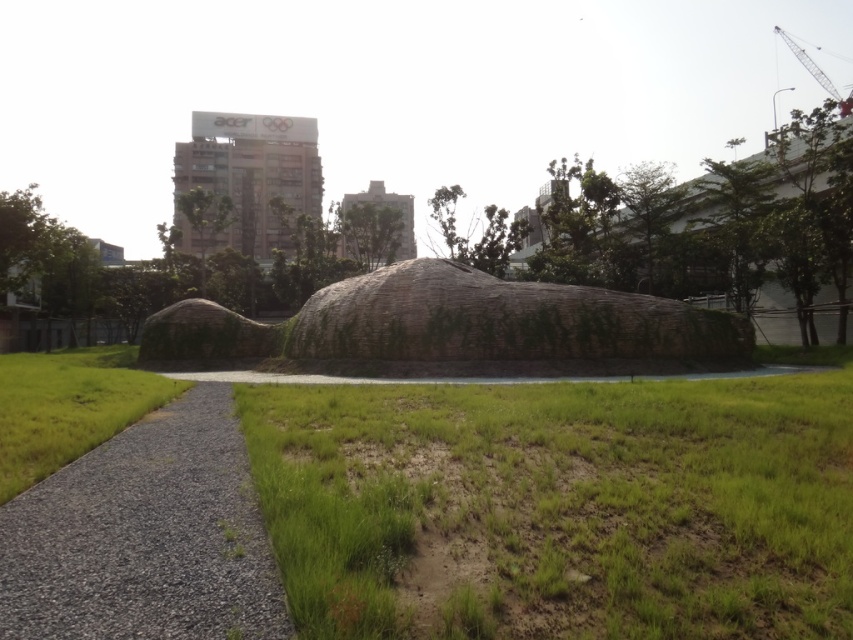
Is green grass at lower left bigger than metallic gray crane at upper right?

Actually, green grass at lower left might be smaller than metallic gray crane at upper right.

Is green grass at lower left closer to the viewer compared to metallic gray crane at upper right?

Yes, it is.

Is point (9, 481) positioned after point (822, 84)?

No, it is in front of (822, 84).

Where is `green grass at lower left`? This screenshot has width=853, height=640. green grass at lower left is located at coordinates (68, 406).

Which is more to the left, green grassy at center or gravelly gray path at center?

gravelly gray path at center

Is point (389, 392) positioned before point (152, 592)?

No, it is not.

This screenshot has height=640, width=853. Identify the location of green grassy at center. (566, 504).

Is gravelly gray path at center taller than green grass at lower left?

In fact, gravelly gray path at center may be shorter than green grass at lower left.

Is gravelly gray path at center to the right of green grass at lower left from the viewer's perspective?

Correct, you'll find gravelly gray path at center to the right of green grass at lower left.

This screenshot has width=853, height=640. Find the location of `gravelly gray path at center`. gravelly gray path at center is located at coordinates click(144, 538).

The image size is (853, 640). Find the location of `gravelly gray path at center`. gravelly gray path at center is located at coordinates (144, 538).